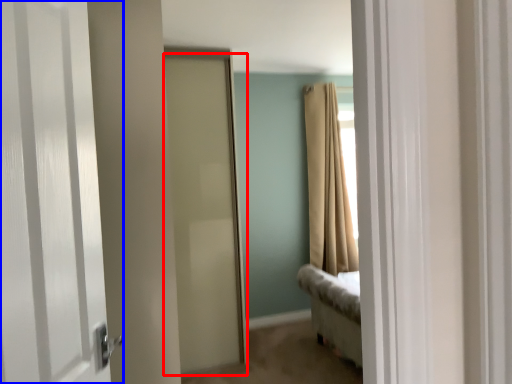
Question: Which point is closer to the camera, door (highlighted by a red box) or door (highlighted by a blue box)?

Choices:
 (A) door
 (B) door

Answer: (B)